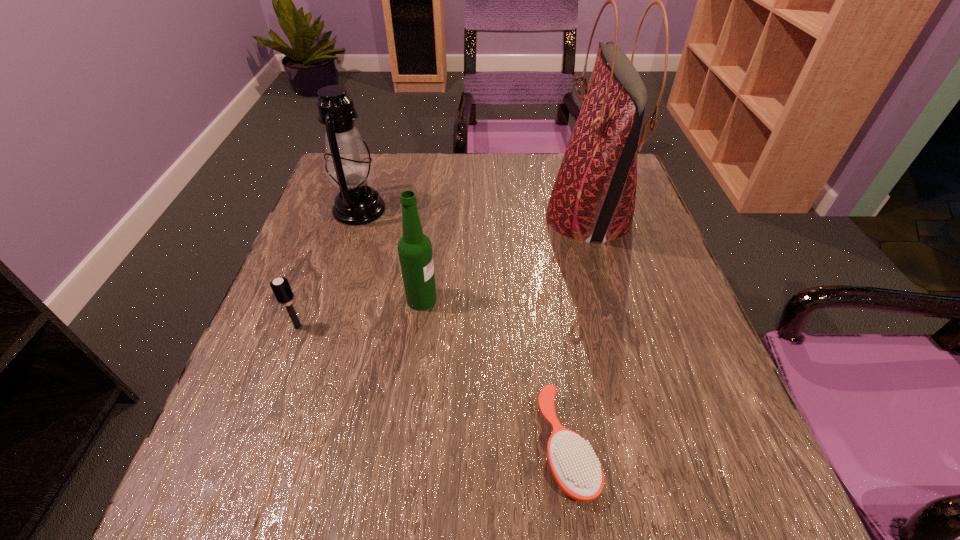
Where is `empty location between the nearest object and the handbag`? Image resolution: width=960 pixels, height=540 pixels. empty location between the nearest object and the handbag is located at coordinates (578, 332).

At what (x,y) coordinates should I click in order to perform the action: click on vacant space in between the third shortest object and the tallest object. Please return your answer as a coordinate pair (x, y). The image size is (960, 540). Looking at the image, I should click on (505, 259).

Image resolution: width=960 pixels, height=540 pixels. Identify the location of vacant region between the farther hairbrush and the tallest object. (444, 272).

Where is `free space that is in between the oil lamp and the beer bottle`? Image resolution: width=960 pixels, height=540 pixels. free space that is in between the oil lamp and the beer bottle is located at coordinates tap(391, 254).

I want to click on free space that is in between the fourth farthest object and the handbag, so click(x=444, y=272).

Locate which object ranks third in proximity to the oil lamp. Please provide its 2D coordinates. Your answer should be formatted as a tuple, i.e. [(x, y)], where the tuple contains the x and y coordinates of a point satisfying the conditions above.

[(593, 198)]

Find the location of a particular element. The image size is (960, 540). the closest object to the second nearest object is located at coordinates (415, 253).

You are a GUI agent. You are given a task and a screenshot of the screen. Output one action in this format:
    pyautogui.click(x=<x>, y=<y>)
    Task: Click on the vacant region that satisfies the following two spatial constraints: 1. on the front side of the right hairbrush; 2. on the left side of the taller hairbrush
    The width and height of the screenshot is (960, 540).
    Given the screenshot: What is the action you would take?
    pyautogui.click(x=253, y=446)

Identify the location of free location that satisfies the following two spatial constraints: 1. on the back side of the fourth farthest object; 2. on the right side of the oil lamp. The width and height of the screenshot is (960, 540). (342, 210).